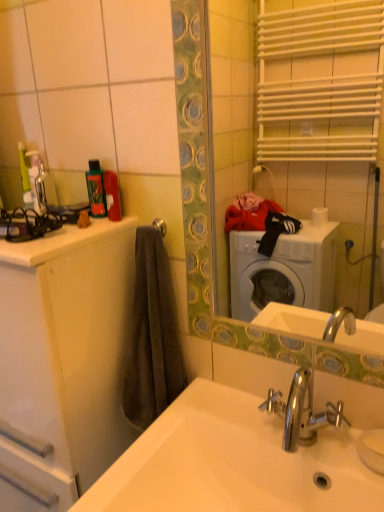
Question: Can you confirm if green plastic bottle at upper left is bigger than white glossy mirror at upper center?

Choices:
 (A) no
 (B) yes

Answer: (A)

Question: From a real-world perspective, is green plastic bottle at upper left on white glossy mirror at upper center?

Choices:
 (A) yes
 (B) no

Answer: (B)

Question: Does green plastic bottle at upper left turn towards white glossy mirror at upper center?

Choices:
 (A) yes
 (B) no

Answer: (B)

Question: Is green plastic bottle at upper left taller than white glossy mirror at upper center?

Choices:
 (A) yes
 (B) no

Answer: (B)

Question: Is green plastic bottle at upper left oriented away from white glossy mirror at upper center?

Choices:
 (A) no
 (B) yes

Answer: (A)

Question: From a real-world perspective, is green plastic bottle at upper left positioned above or below white glossy cabinet at left?

Choices:
 (A) below
 (B) above

Answer: (B)

Question: Considering the positions of green plastic bottle at upper left and white glossy cabinet at left in the image, is green plastic bottle at upper left taller or shorter than white glossy cabinet at left?

Choices:
 (A) tall
 (B) short

Answer: (B)

Question: Is point (99, 202) closer or farther from the camera than point (18, 404)?

Choices:
 (A) farther
 (B) closer

Answer: (A)

Question: In terms of width, does green plastic bottle at upper left look wider or thinner when compared to white glossy cabinet at left?

Choices:
 (A) wide
 (B) thin

Answer: (B)

Question: Is point (362, 487) positioned closer to the camera than point (345, 284)?

Choices:
 (A) farther
 (B) closer

Answer: (B)

Question: From the image's perspective, is white glossy sink at lower center above or below white glossy mirror at upper center?

Choices:
 (A) below
 (B) above

Answer: (A)

Question: Considering the positions of white glossy sink at lower center and white glossy mirror at upper center in the image, is white glossy sink at lower center bigger or smaller than white glossy mirror at upper center?

Choices:
 (A) small
 (B) big

Answer: (B)

Question: From their relative heights in the image, would you say white glossy sink at lower center is taller or shorter than white glossy mirror at upper center?

Choices:
 (A) tall
 (B) short

Answer: (B)

Question: Is white glossy mirror at upper center wider or thinner than green plastic bottle at upper left?

Choices:
 (A) thin
 (B) wide

Answer: (A)

Question: Based on their positions, is white glossy mirror at upper center located to the left or right of green plastic bottle at upper left?

Choices:
 (A) left
 (B) right

Answer: (B)